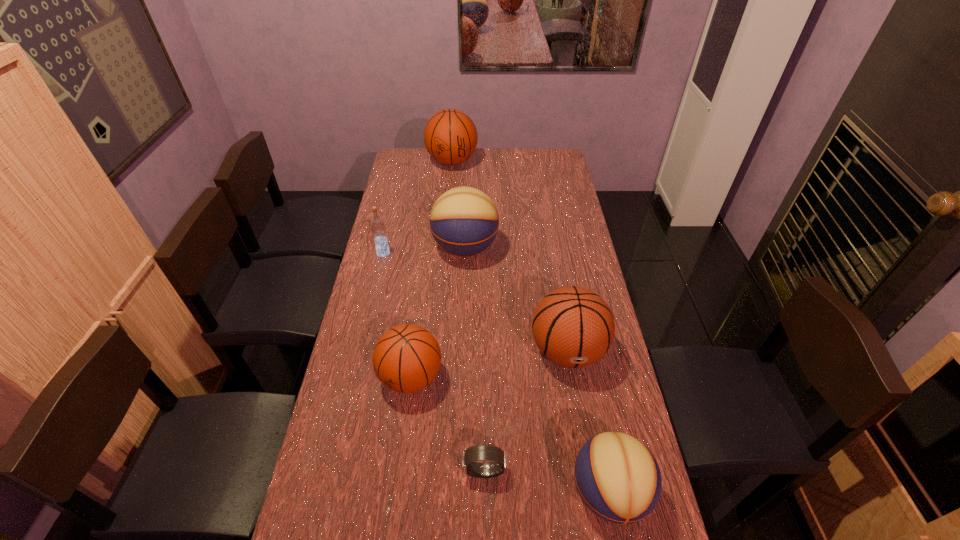
This screenshot has height=540, width=960. I want to click on watch, so click(x=479, y=452).

Where is `blank area located 0.170m on the right of the farthest orange basketball`? This screenshot has width=960, height=540. blank area located 0.170m on the right of the farthest orange basketball is located at coordinates (512, 162).

The height and width of the screenshot is (540, 960). What are the coordinates of `free space located on the patterned surface of the left blue basketball` in the screenshot? It's located at (521, 248).

The image size is (960, 540). Identify the location of vacant position located 0.230m on the side where the inflation valve is located. (586, 461).

The width and height of the screenshot is (960, 540). Identify the location of free space located 0.210m on the back of the leftmost object. (392, 217).

Locate an element on the screen. This screenshot has height=540, width=960. free spot located 0.090m on the back of the smallest orange basketball is located at coordinates (418, 329).

You are a GUI agent. You are given a task and a screenshot of the screen. Output one action in this format:
    pyautogui.click(x=<x>, y=<y>)
    Task: Click on the free spot located on the face of the shortest object
    This screenshot has height=540, width=960.
    Given the screenshot: What is the action you would take?
    pyautogui.click(x=370, y=471)

The image size is (960, 540). What are the coordinates of `free space located 0.190m on the face of the shortest object` in the screenshot? It's located at (389, 471).

Locate an element on the screen. free space located on the face of the shortest object is located at coordinates (408, 471).

The image size is (960, 540). Identify the location of object present at the far edge. (450, 136).